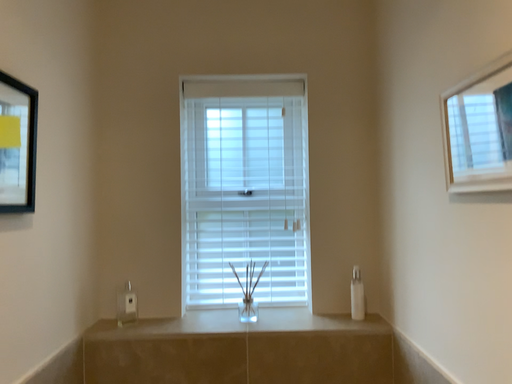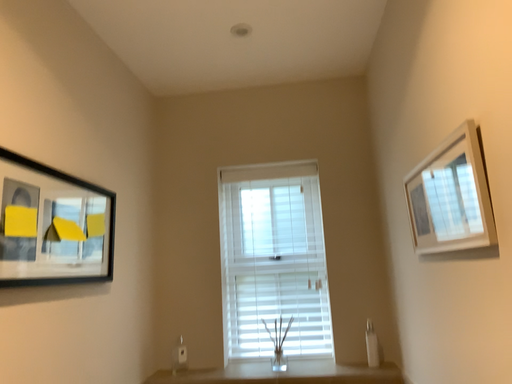
Question: How did the camera likely rotate when shooting the video?

Choices:
 (A) rotated left
 (B) rotated right

Answer: (A)